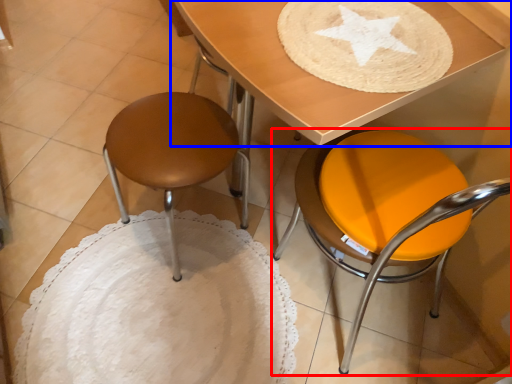
Question: Which of the following is the farthest to the observer, chair (highlighted by a red box) or table (highlighted by a blue box)?

Choices:
 (A) chair
 (B) table

Answer: (B)